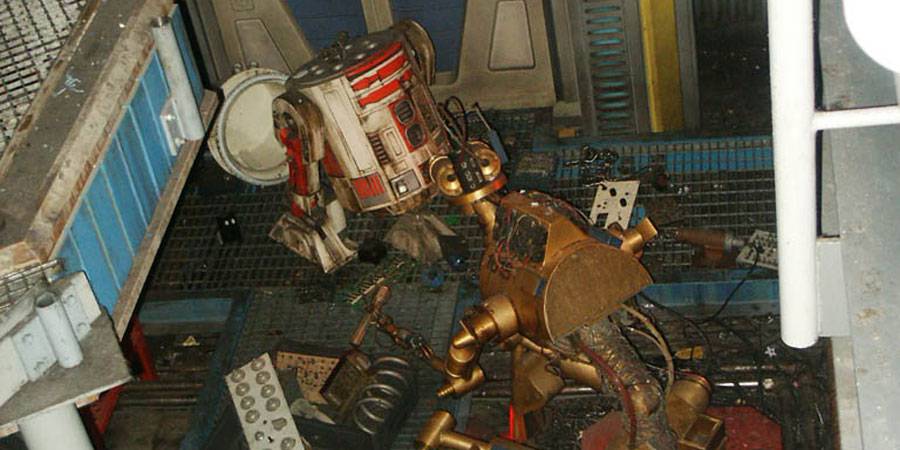
Where is `grid floor`? Image resolution: width=900 pixels, height=450 pixels. grid floor is located at coordinates (203, 234), (717, 197), (295, 315).